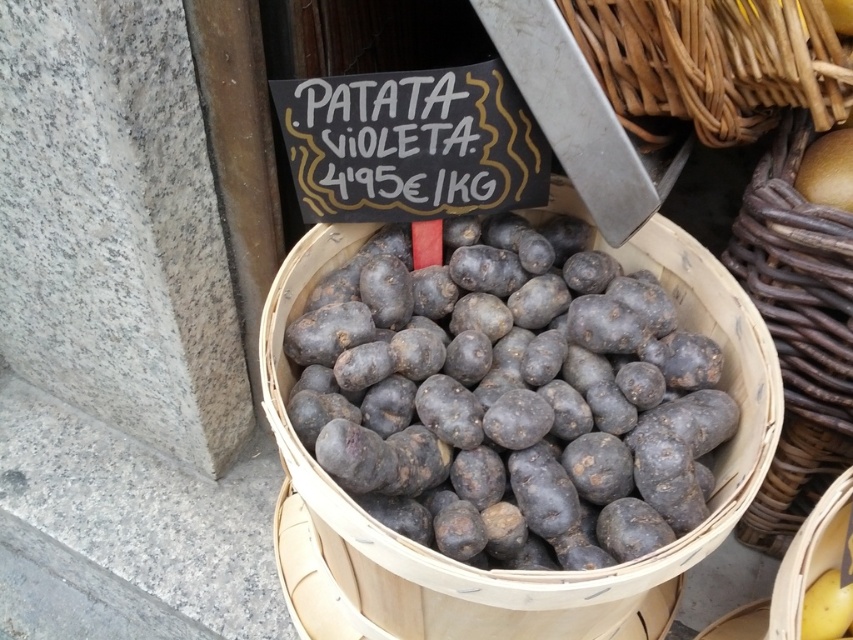
How much distance is there between rustic wicker basket at center and woven brown basket at upper right?

rustic wicker basket at center and woven brown basket at upper right are 22.85 centimeters apart.

Between rustic wicker basket at center and woven brown basket at upper right, which one appears on the left side from the viewer's perspective?

woven brown basket at upper right

Describe the element at coordinates (798, 330) in the screenshot. I see `rustic wicker basket at center` at that location.

Locate an element on the screen. rustic wicker basket at center is located at coordinates (798, 330).

Can you confirm if matte purple potatoes at center is thinner than woven brown basket at upper right?

Incorrect, matte purple potatoes at center's width is not less than woven brown basket at upper right's.

Locate an element on the screen. This screenshot has width=853, height=640. matte purple potatoes at center is located at coordinates (509, 397).

In the scene shown: Which is below, matte purple potatoes at center or rustic wicker basket at center?

rustic wicker basket at center is lower down.

Is point (596, 372) less distant than point (828, 342)?

Yes, it is in front of point (828, 342).

The image size is (853, 640). Describe the element at coordinates (509, 397) in the screenshot. I see `matte purple potatoes at center` at that location.

At what (x,y) coordinates should I click in order to perform the action: click on matte purple potatoes at center. Please return your answer as a coordinate pair (x, y). The height and width of the screenshot is (640, 853). Looking at the image, I should click on (509, 397).